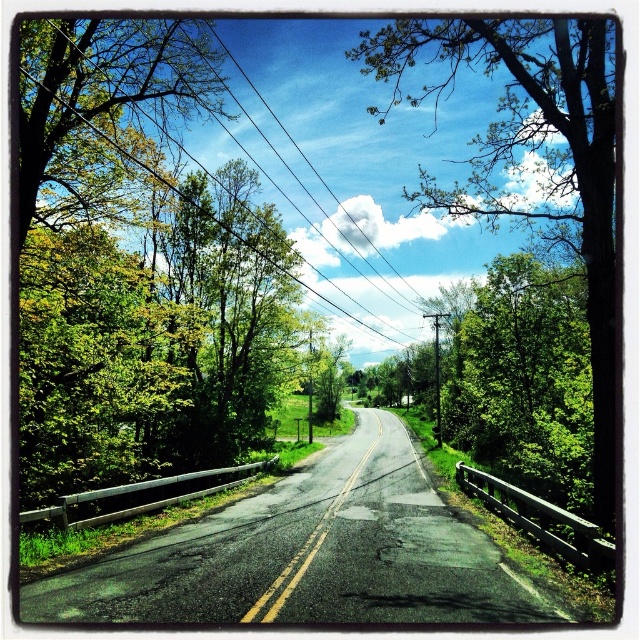
Does green leafy tree at left have a lesser width compared to green leafy tree at center?

Yes.

Which of these two, green leafy tree at left or green leafy tree at center, stands shorter?

Standing shorter between the two is green leafy tree at left.

Find the location of a particular element. The image size is (640, 640). green leafy tree at left is located at coordinates (140, 268).

Who is more forward, (156,324) or (300,148)?

Positioned in front is point (156,324).

Measure the distance between point (221, 388) and camera.

The distance of point (221, 388) from camera is 31.43 meters.

The height and width of the screenshot is (640, 640). Identify the location of green leafy tree at left. (140, 268).

Looking at this image, is green leafy tree at center positioned at the back of black wire at upper center?

No, it is not.

Which of these two, green leafy tree at center or black wire at upper center, stands shorter?

With less height is black wire at upper center.

Between point (538, 136) and point (228, 58), which one is positioned in front?

Positioned in front is point (538, 136).

Where is `green leafy tree at center`? green leafy tree at center is located at coordinates (x=531, y=157).